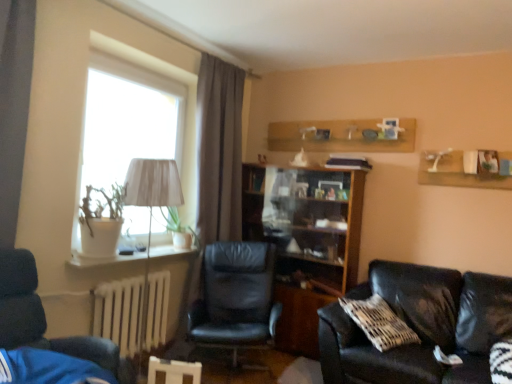
Question: From the image's perspective, would you say white fabric lampshade at left is positioned over dark blue leather chair at left, which is counted as the 1th chair, starting from the front?

Choices:
 (A) yes
 (B) no

Answer: (A)

Question: Considering the relative positions of white fabric lampshade at left and dark blue leather chair at left, the 2th chair viewed from the back, in the image provided, is white fabric lampshade at left to the left of dark blue leather chair at left, the 2th chair viewed from the back, from the viewer's perspective?

Choices:
 (A) yes
 (B) no

Answer: (B)

Question: Is white fabric lampshade at left directly adjacent to dark blue leather chair at left, which is counted as the 1th chair, starting from the front?

Choices:
 (A) no
 (B) yes

Answer: (A)

Question: Does white fabric lampshade at left have a greater height compared to dark blue leather chair at left, the first chair from the left?

Choices:
 (A) yes
 (B) no

Answer: (A)

Question: Is dark blue leather chair at left, which is counted as the 1th chair, starting from the front, a part of white fabric lampshade at left?

Choices:
 (A) yes
 (B) no

Answer: (B)

Question: Based on their positions, is dark blue leather chair at left, the first chair from the left, located to the left or right of black leather chair at center, which ranks as the second chair in front-to-back order?

Choices:
 (A) right
 (B) left

Answer: (B)

Question: In terms of width, does dark blue leather chair at left, which is counted as the 1th chair, starting from the front, look wider or thinner when compared to black leather chair at center, which ranks as the second chair in front-to-back order?

Choices:
 (A) thin
 (B) wide

Answer: (B)

Question: Choose the correct answer: Is dark blue leather chair at left, the 2th chair viewed from the back, inside black leather chair at center, which ranks as the second chair in front-to-back order, or outside it?

Choices:
 (A) inside
 (B) outside

Answer: (B)

Question: Is point (41, 347) positioned closer to the camera than point (201, 317)?

Choices:
 (A) closer
 (B) farther

Answer: (A)

Question: Based on their sizes in the image, would you say white fabric lampshade at left is bigger or smaller than white painted metal radiator at lower left?

Choices:
 (A) small
 (B) big

Answer: (B)

Question: Considering the positions of white fabric lampshade at left and white painted metal radiator at lower left in the image, is white fabric lampshade at left taller or shorter than white painted metal radiator at lower left?

Choices:
 (A) short
 (B) tall

Answer: (B)

Question: Looking at their shapes, would you say white fabric lampshade at left is wider or thinner than white painted metal radiator at lower left?

Choices:
 (A) thin
 (B) wide

Answer: (B)

Question: Is white fabric lampshade at left inside the boundaries of white painted metal radiator at lower left, or outside?

Choices:
 (A) inside
 (B) outside

Answer: (B)

Question: From the image's perspective, relative to white fabric lampshade at left, is black leather couch at lower right above or below?

Choices:
 (A) above
 (B) below

Answer: (B)

Question: Considering the relative positions of black leather couch at lower right and white fabric lampshade at left in the image provided, is black leather couch at lower right to the left or to the right of white fabric lampshade at left?

Choices:
 (A) left
 (B) right

Answer: (B)